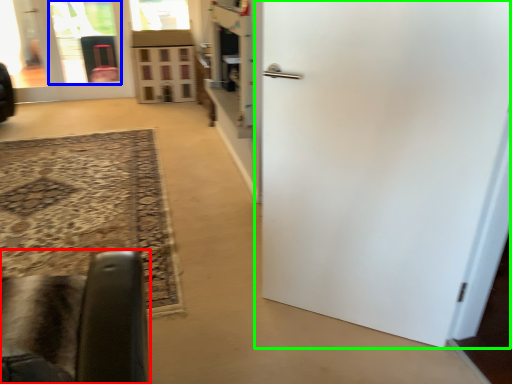
Question: Which object is the farthest from furniture (highlighted by a red box)? Choose among these: glass door (highlighted by a blue box) or door (highlighted by a green box).

Choices:
 (A) glass door
 (B) door

Answer: (A)